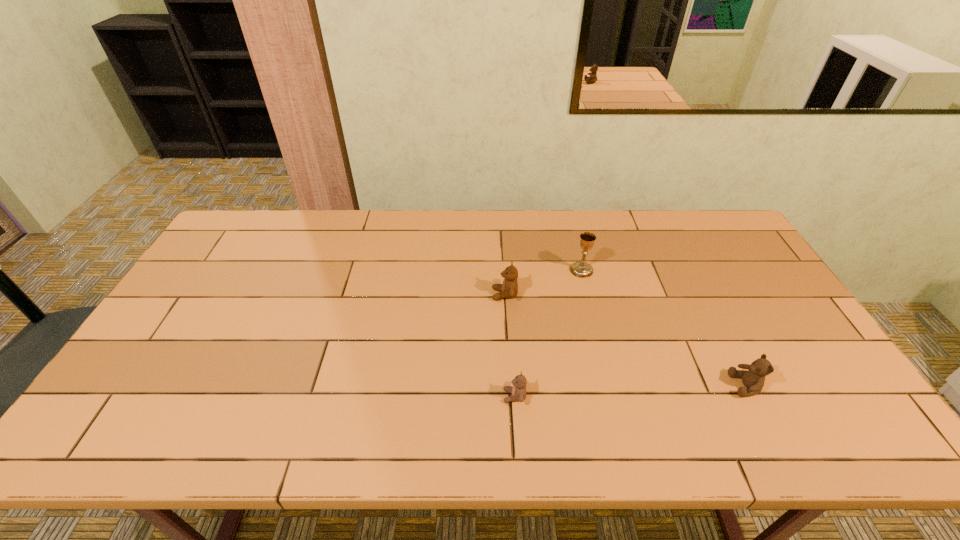
Where is `vacant space at the far right corner of the desktop`? The image size is (960, 540). vacant space at the far right corner of the desktop is located at coordinates (698, 219).

Locate an element on the screen. This screenshot has width=960, height=540. vacant space at the near right corner of the desktop is located at coordinates (856, 430).

Locate an element on the screen. This screenshot has width=960, height=540. unoccupied position between the rightmost object and the shortest object is located at coordinates (630, 391).

Where is `vacant point located between the third object from left to right and the shortest object`? The width and height of the screenshot is (960, 540). vacant point located between the third object from left to right and the shortest object is located at coordinates (548, 333).

Locate an element on the screen. vacant space that is in between the third nearest object and the shortest object is located at coordinates (510, 345).

I want to click on vacant space in between the farthest teddy bear and the shortest object, so click(x=510, y=345).

Locate an element on the screen. vacant space in between the second tallest teddy bear and the farthest teddy bear is located at coordinates (625, 340).

Locate an element on the screen. Image resolution: width=960 pixels, height=540 pixels. vacant space that is in between the chalice and the third nearest object is located at coordinates (543, 282).

Find the location of a particular element. This screenshot has height=540, width=960. unoccupied area between the farthest object and the second shortest teddy bear is located at coordinates (663, 328).

The width and height of the screenshot is (960, 540). In order to click on vacant space in between the farthest teddy bear and the rightmost teddy bear in this screenshot , I will do `click(625, 340)`.